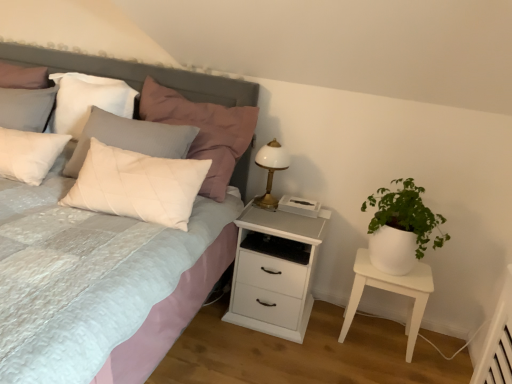
Locate an element on the screen. Image resolution: width=512 pixels, height=384 pixels. free location to the right of white matte table at right is located at coordinates (440, 353).